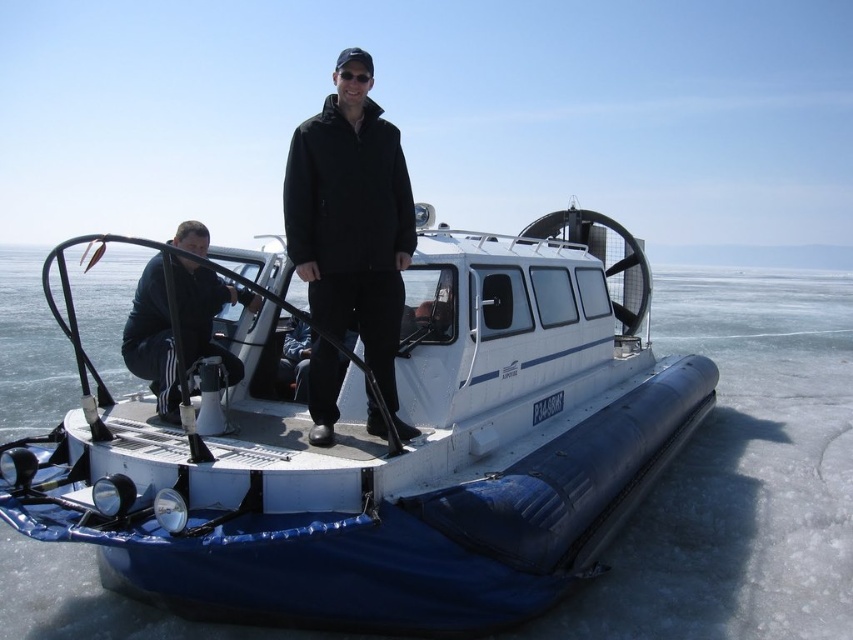
Measure the distance between white rubber hovercraft at center and camera.

white rubber hovercraft at center is 6.28 meters from camera.

Which is below, white rubber hovercraft at center or black matte jacket at center?

white rubber hovercraft at center is below.

Is point (415, 246) positioned before point (387, 321)?

No, it is behind (387, 321).

You are a GUI agent. You are given a task and a screenshot of the screen. Output one action in this format:
    pyautogui.click(x=<x>, y=<y>)
    Task: Click on the white rubber hovercraft at center
    
    Given the screenshot: What is the action you would take?
    pyautogui.click(x=374, y=444)

Can you confirm if white rubber hovercraft at center is shorter than black matte jacket at lower left?

Yes.

Does white rubber hovercraft at center have a greater height compared to black matte jacket at lower left?

Incorrect, white rubber hovercraft at center's height is not larger of black matte jacket at lower left's.

Does point (428, 358) lie behind point (149, 264)?

No, it is in front of (149, 264).

This screenshot has width=853, height=640. In order to click on white rubber hovercraft at center in this screenshot , I will do `click(374, 444)`.

Between point (306, 234) and point (189, 317), which one is positioned in front?

Positioned in front is point (306, 234).

Can you confirm if black matte jacket at center is thinner than black matte jacket at lower left?

Indeed, black matte jacket at center has a lesser width compared to black matte jacket at lower left.

Measure the distance between black matte jacket at center and camera.

black matte jacket at center and camera are 15.75 feet apart from each other.

This screenshot has width=853, height=640. In order to click on black matte jacket at center in this screenshot , I will do `click(352, 220)`.